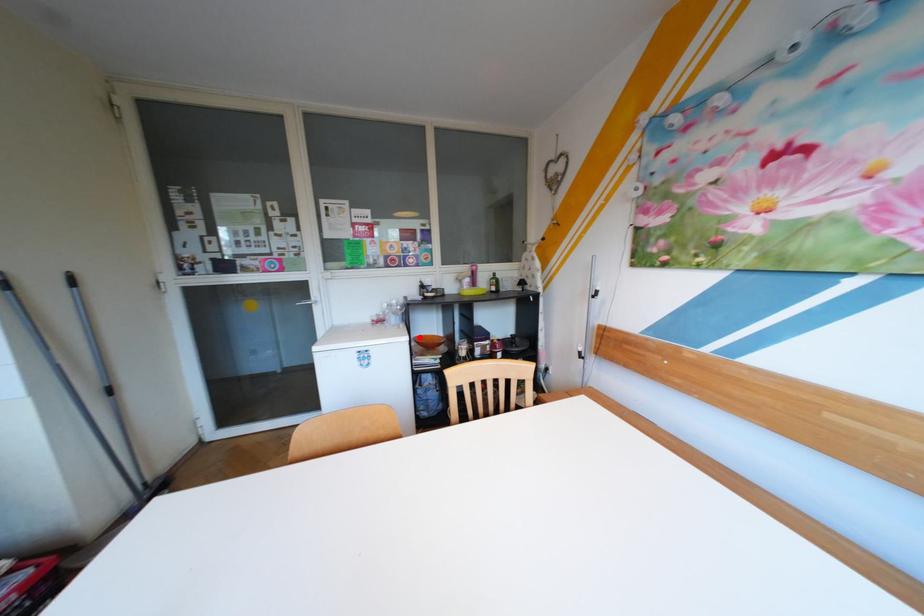
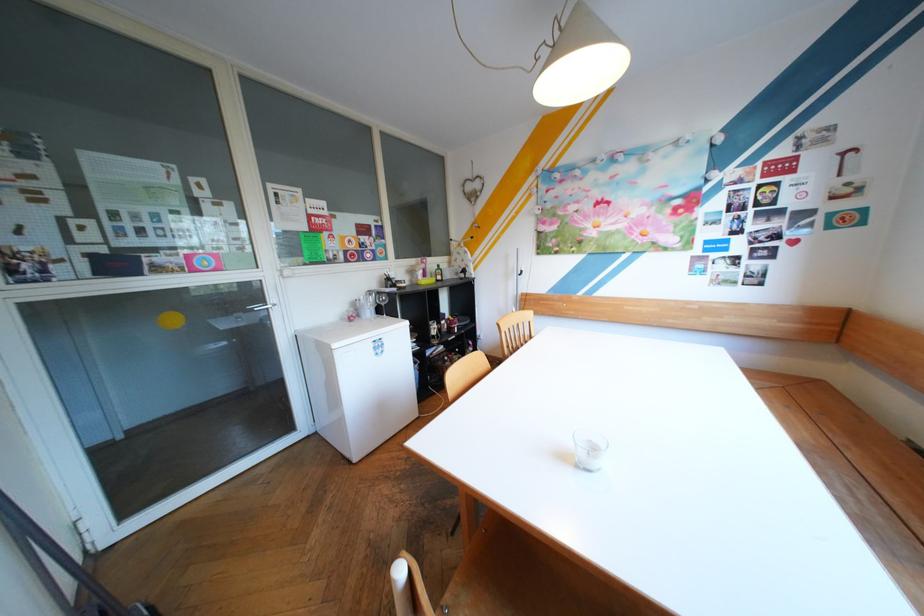
Question: I am providing you with two images of the same scene from different viewpoints. A red point is marked on the first image. Is the red point's position out of view in image 2?

Choices:
 (A) Yes
 (B) No

Answer: (A)